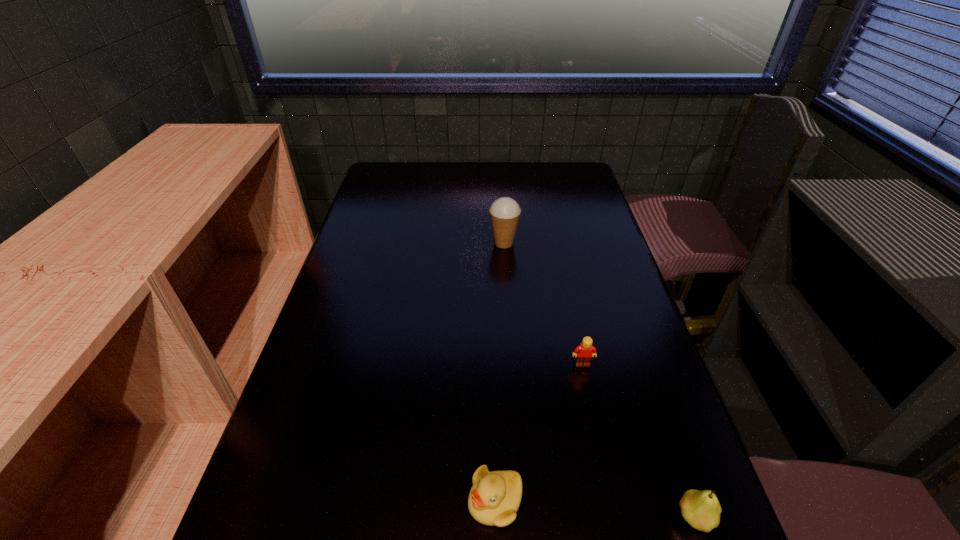
I want to click on vacant region located 0.300m on the beak of the duckling, so click(x=300, y=501).

This screenshot has width=960, height=540. What are the coordinates of `blank space located 0.300m on the beak of the duckling` in the screenshot? It's located at (300, 501).

The width and height of the screenshot is (960, 540). I want to click on free space located on the beak of the duckling, so click(267, 501).

This screenshot has width=960, height=540. Find the location of `pear situated at the right edge`. pear situated at the right edge is located at coordinates (701, 509).

Where is `Lego positioned at the right edge`? The width and height of the screenshot is (960, 540). Lego positioned at the right edge is located at coordinates (584, 352).

This screenshot has height=540, width=960. In order to click on free space at the far edge of the desktop in this screenshot , I will do `click(426, 166)`.

What are the coordinates of `vacant space at the left edge of the desktop` in the screenshot? It's located at (375, 207).

The height and width of the screenshot is (540, 960). I want to click on vacant region at the right edge of the desktop, so click(627, 396).

Where is `free space at the far left corner`? The height and width of the screenshot is (540, 960). free space at the far left corner is located at coordinates pos(382,167).

Identify the location of free space at the far right corner. (579, 163).